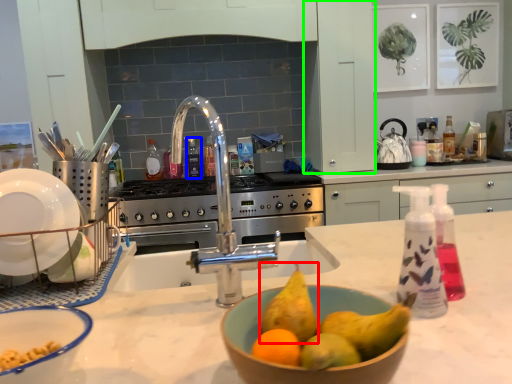
Question: Which object is the closest to the pear (highlighted by a red box)? Choose among these: bottle (highlighted by a blue box) or cabinetry (highlighted by a green box).

Choices:
 (A) bottle
 (B) cabinetry

Answer: (B)